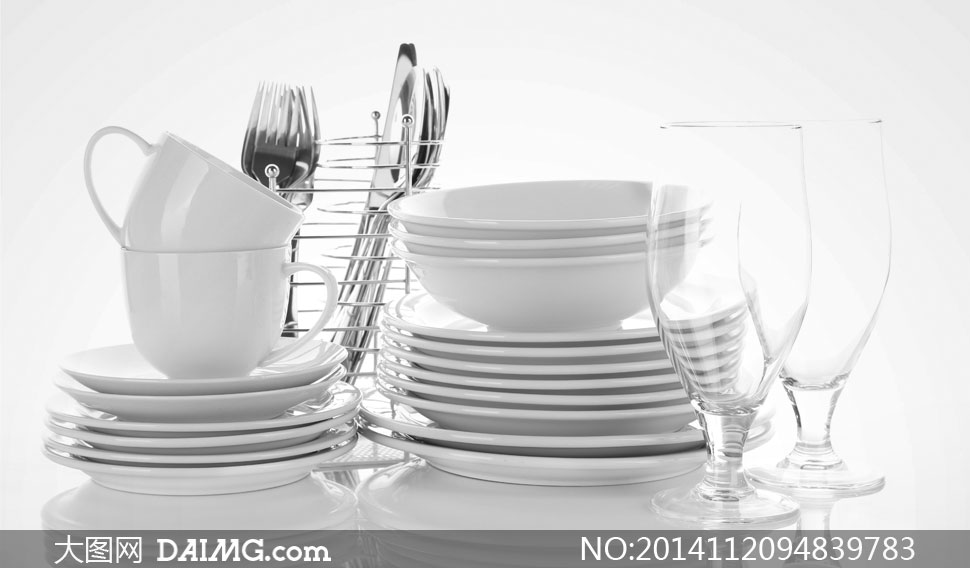
Where is `plates on right side`? plates on right side is located at coordinates (605, 462), (611, 440), (611, 415), (616, 399), (619, 383), (619, 369), (622, 348), (602, 333).